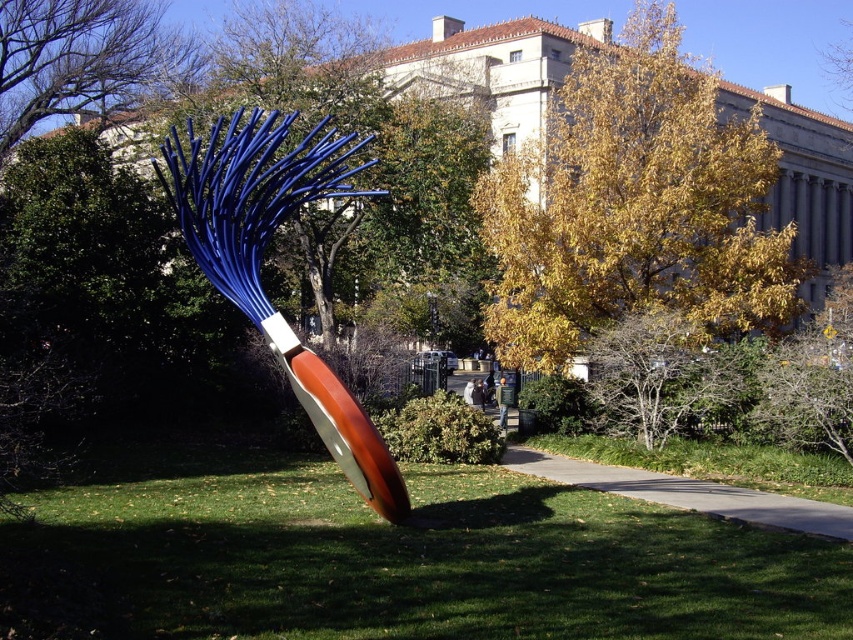
From the picture: You are standing at the base of the giant paintbrush sculpture. Looking towards the classical building in the background, you notice a point marked at coordinates (x=634, y=205). What object is located at that point?

The golden leafy tree at upper center is located at point (x=634, y=205).

You are standing at the entrance of the classical building and looking towards the sculpture. Which area of green grass is closer to the sculpture, the green grass at center or the green grass at lower center?

The green grass at center is closer to the sculpture because it is located below the green grass at lower center, placing it nearer to the sculpture in the foreground.

You are standing in front of the sculpture and want to take a photo. There are two points of interest marked in the image at coordinates point (x=619, y=240) and point (x=80, y=108). Which point is closer to your camera lens when you aim at the sculpture?

Point (x=619, y=240) is closer to the camera than point (x=80, y=108).